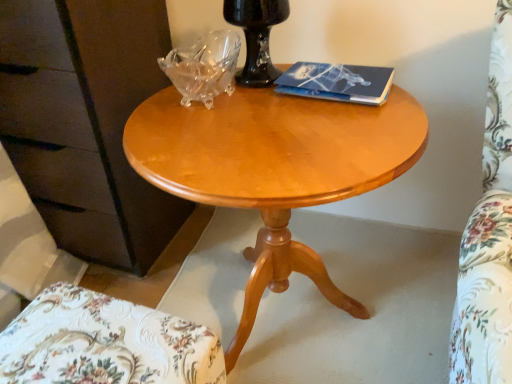
Question: From the image's perspective, is light wood/finish coffee table at center on blue matte paper at upper right?

Choices:
 (A) yes
 (B) no

Answer: (B)

Question: Can blue matte paper at upper right be found inside light wood/finish coffee table at center?

Choices:
 (A) no
 (B) yes

Answer: (B)

Question: Is light wood/finish coffee table at center directly adjacent to blue matte paper at upper right?

Choices:
 (A) no
 (B) yes

Answer: (A)

Question: Considering the relative positions of light wood/finish coffee table at center and blue matte paper at upper right in the image provided, is light wood/finish coffee table at center behind blue matte paper at upper right?

Choices:
 (A) yes
 (B) no

Answer: (B)

Question: Is light wood/finish coffee table at center closer to the viewer compared to blue matte paper at upper right?

Choices:
 (A) no
 (B) yes

Answer: (B)

Question: Is light wood/finish coffee table at center to the left or to the right of matte brown dresser at left in the image?

Choices:
 (A) left
 (B) right

Answer: (B)

Question: Do you think light wood/finish coffee table at center is within matte brown dresser at left, or outside of it?

Choices:
 (A) inside
 (B) outside

Answer: (B)

Question: In the image, is light wood/finish coffee table at center positioned in front of or behind matte brown dresser at left?

Choices:
 (A) behind
 (B) front

Answer: (B)

Question: Does point (227, 158) appear closer or farther from the camera than point (112, 84)?

Choices:
 (A) closer
 (B) farther

Answer: (A)

Question: Visually, is white floral fabric chair at lower left positioned to the left or to the right of matte brown dresser at left?

Choices:
 (A) right
 (B) left

Answer: (A)

Question: Is point tap(50, 304) closer or farther from the camera than point tap(96, 193)?

Choices:
 (A) farther
 (B) closer

Answer: (B)

Question: Considering the positions of white floral fabric chair at lower left and matte brown dresser at left in the image, is white floral fabric chair at lower left wider or thinner than matte brown dresser at left?

Choices:
 (A) wide
 (B) thin

Answer: (B)

Question: Is white floral fabric chair at lower left inside or outside of matte brown dresser at left?

Choices:
 (A) outside
 (B) inside

Answer: (A)

Question: Does point (361, 87) appear closer or farther from the camera than point (93, 370)?

Choices:
 (A) farther
 (B) closer

Answer: (A)

Question: Relative to white floral fabric chair at lower left, is blue matte paper at upper right in front or behind?

Choices:
 (A) front
 (B) behind

Answer: (B)